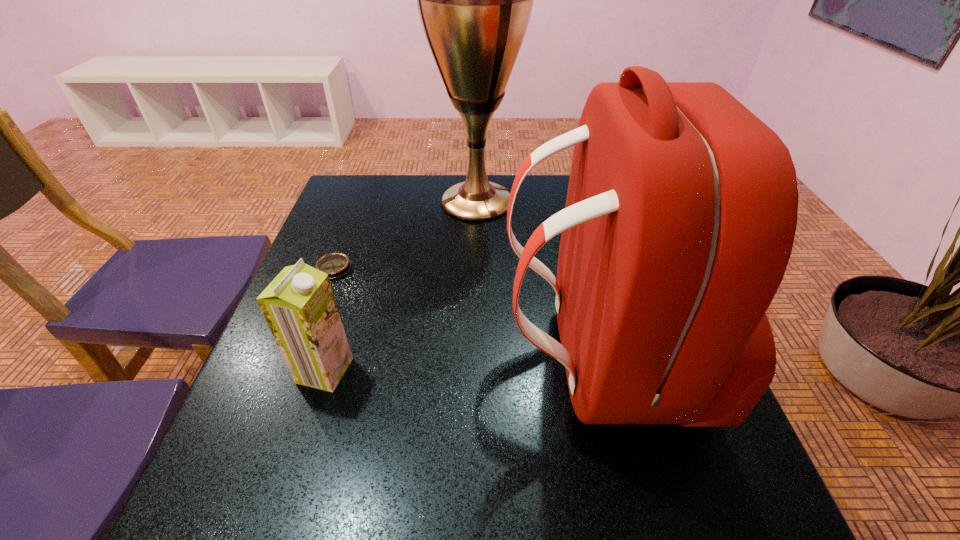
In order to click on free space between the trophy cup and the backpack in this screenshot , I will do point(537,280).

Identify the location of free space between the trophy cup and the backpack. (537, 280).

Find the location of `unoccupied area between the backpack and the second shortest object`. unoccupied area between the backpack and the second shortest object is located at coordinates (461, 365).

The height and width of the screenshot is (540, 960). I want to click on free space between the second shortest object and the backpack, so pyautogui.click(x=461, y=365).

At what (x,y) coordinates should I click in order to perform the action: click on unoccupied position between the second farthest object and the backpack. Please return your answer as a coordinate pair (x, y). This screenshot has height=540, width=960. Looking at the image, I should click on (466, 313).

Identify the location of free area in between the backpack and the soya milk. (461, 365).

Point out which object is positioned as the second nearest to the shortest object. Please provide its 2D coordinates. Your answer should be formatted as a tuple, i.e. [(x, y)], where the tuple contains the x and y coordinates of a point satisfying the conditions above.

[(475, 0)]

Locate an element on the screen. The width and height of the screenshot is (960, 540). the second closest object to the third nearest object is located at coordinates (475, 0).

This screenshot has height=540, width=960. In order to click on vacant point that satisfies the following two spatial constraints: 1. on the strap side of the backpack; 2. on the front side of the soya milk in this screenshot , I will do `click(600, 371)`.